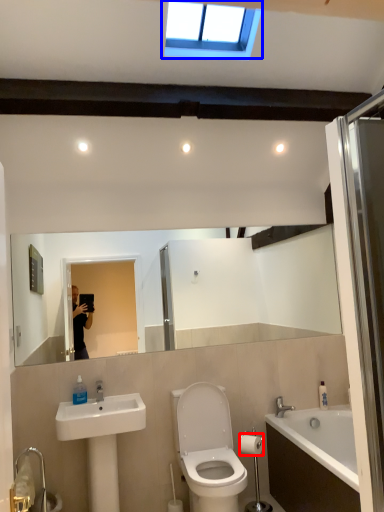
Question: Which object is further to the camera taking this photo, toilet paper (highlighted by a red box) or window (highlighted by a blue box)?

Choices:
 (A) toilet paper
 (B) window

Answer: (A)